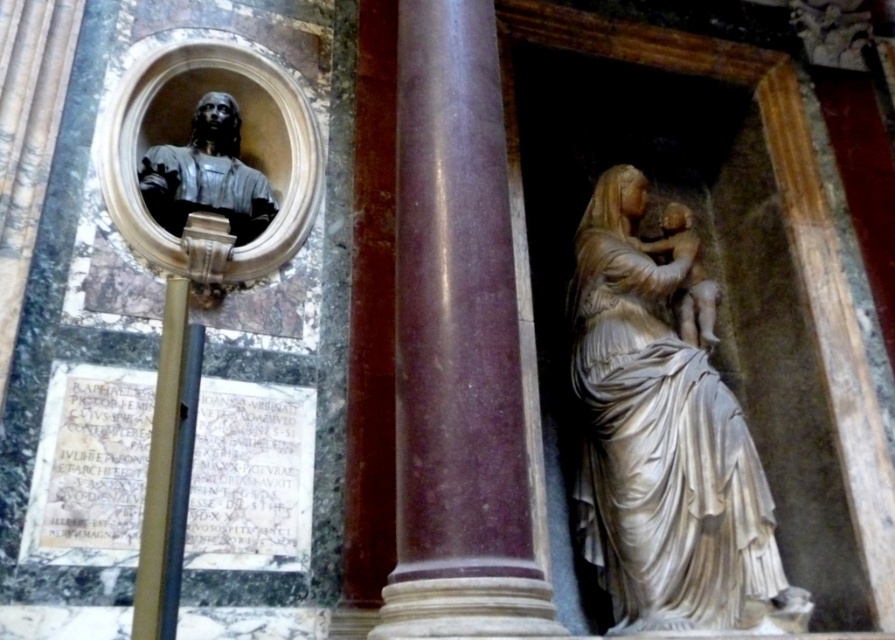
Who is positioned more to the right, polished bronze bust at upper left or white marble statue at right?

From the viewer's perspective, white marble statue at right appears more on the right side.

Find the location of a particular element. polished bronze bust at upper left is located at coordinates [207, 173].

Who is shorter, purple marble column at center or white marble statue at center?

Standing shorter between the two is white marble statue at center.

Between point (446, 163) and point (640, 449), which one is positioned behind?

Point (640, 449)

This screenshot has height=640, width=895. In order to click on purple marble column at center in this screenshot , I will do `click(457, 346)`.

Can you confirm if white marble statue at center is positioned above white marble statue at right?

Actually, white marble statue at center is below white marble statue at right.

Can you confirm if white marble statue at center is wider than white marble statue at right?

Yes, white marble statue at center is wider than white marble statue at right.

In order to click on white marble statue at center in this screenshot , I will do `click(663, 436)`.